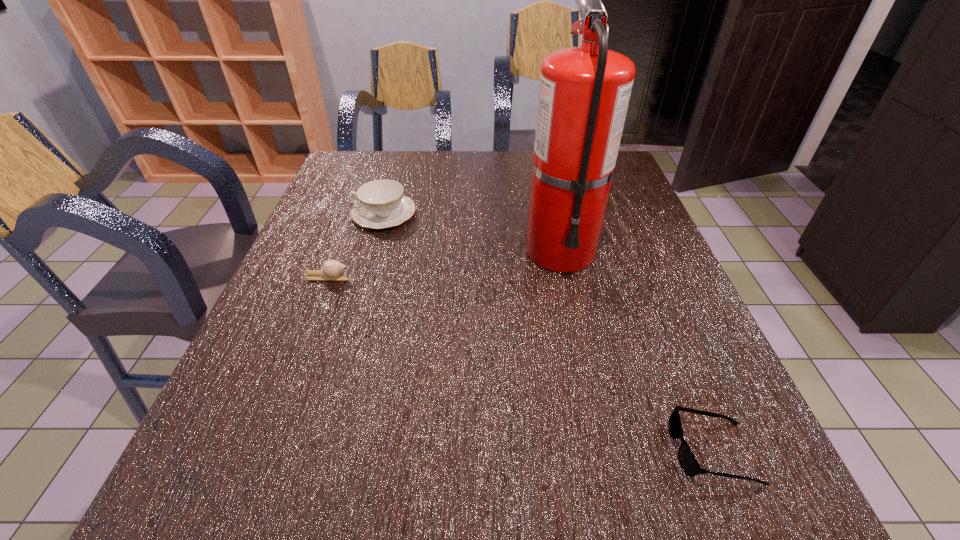
Locate an element on the screen. vacant space that's between the third shortest object and the second object from right to left is located at coordinates (472, 232).

The height and width of the screenshot is (540, 960). In order to click on vacant area between the escargot and the fire extinguisher in this screenshot , I will do `click(444, 264)`.

Find the location of a particular element. This screenshot has height=540, width=960. object that is the second closest to the rightmost object is located at coordinates (331, 270).

Locate which object is the third closest to the escargot. Please provide its 2D coordinates. Your answer should be formatted as a tuple, i.e. [(x, y)], where the tuple contains the x and y coordinates of a point satisfying the conditions above.

[(687, 460)]

The width and height of the screenshot is (960, 540). I want to click on free space that satisfies the following two spatial constraints: 1. at the nozzle of the second object from right to left; 2. on the shell of the escargot, so point(566,277).

Where is `free space that satisfies the following two spatial constraints: 1. at the nozzle of the fire extinguisher; 2. on the shell of the escargot`? free space that satisfies the following two spatial constraints: 1. at the nozzle of the fire extinguisher; 2. on the shell of the escargot is located at coordinates [x=566, y=277].

Find the location of a particular element. This screenshot has width=960, height=540. vacant space that satisfies the following two spatial constraints: 1. at the nozzle of the tallest object; 2. on the shell of the escargot is located at coordinates (566, 277).